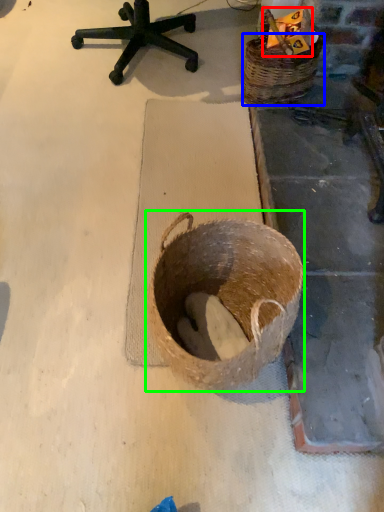
Question: Which object is positioned farthest from scrap (highlighted by a red box)? Select from basket (highlighted by a blue box) and basket (highlighted by a green box).

Choices:
 (A) basket
 (B) basket

Answer: (B)